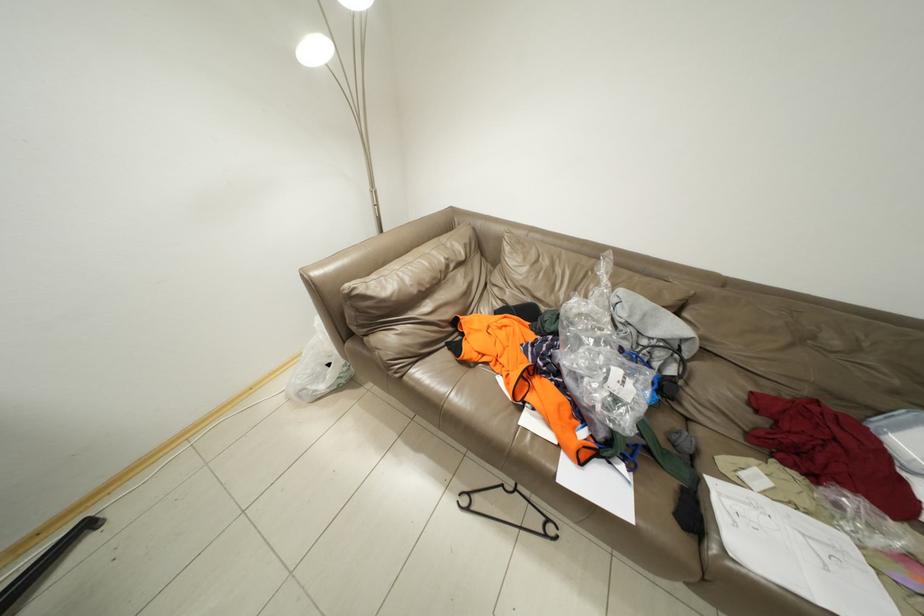
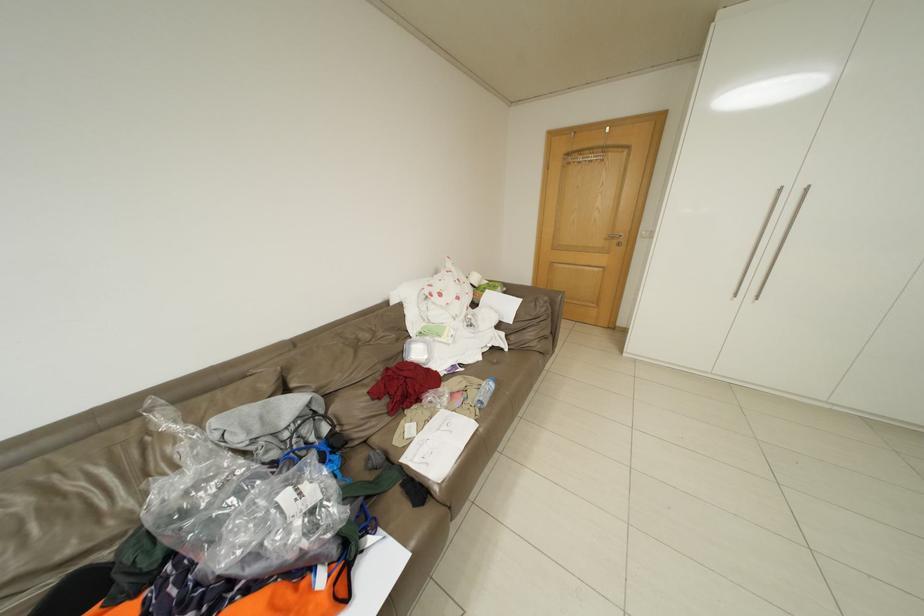
Based on the continuous images, in which direction is the camera rotating?

The camera's rotation is toward right-down.